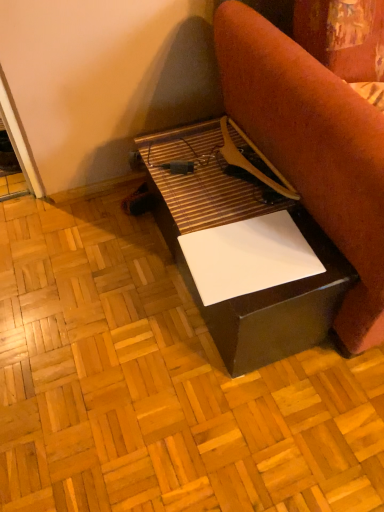
What do you see at coordinates (233, 221) in the screenshot? This screenshot has width=384, height=512. I see `matte black table at center` at bounding box center [233, 221].

At what (x,y) coordinates should I click in order to perform the action: click on matte black table at center. Please return your answer as a coordinate pair (x, y). Image resolution: width=384 pixels, height=512 pixels. Looking at the image, I should click on (233, 221).

Between white glossy paper at center and matte black table at center, which one has smaller width?

With smaller width is matte black table at center.

Could you tell me if white glossy paper at center is facing matte black table at center?

No, white glossy paper at center is not aimed at matte black table at center.

Which is closer to the camera, (246, 13) or (219, 132)?

Point (246, 13) appears to be closer to the viewer than point (219, 132).

Between white glossy paper at center and matte black table at center, which one has less height?

matte black table at center is shorter.

From the image's perspective, which is below, matte black table at center or white glossy paper at center?

matte black table at center is shown below in the image.

Is matte black table at center bigger or smaller than white glossy paper at center?

In the image, matte black table at center appears to be smaller than white glossy paper at center.

There is a matte black table at center. Identify the location of furniture above it (from a real-world perspective). This screenshot has height=512, width=384. (313, 150).

Is white glossy paper at center not near white glossy plywood at center?

white glossy paper at center is actually quite close to white glossy plywood at center.

Between white glossy paper at center and white glossy plywood at center, which one has smaller size?

Smaller between the two is white glossy plywood at center.

Is white glossy paper at center further to camera compared to white glossy plywood at center?

No, white glossy paper at center is closer to the viewer.

Is white glossy paper at center taller or shorter than white glossy plywood at center?

Considering their sizes, white glossy paper at center has more height than white glossy plywood at center.

Which is more to the left, white glossy plywood at center or white glossy paper at center?

white glossy plywood at center.

Is white glossy plywood at center facing towards white glossy paper at center?

No.

Is white glossy plywood at center positioned far away from white glossy paper at center?

That's not correct — white glossy plywood at center is a little close to white glossy paper at center.

How many degrees apart are the facing directions of white glossy plywood at center and white glossy paper at center?

The facing directions of white glossy plywood at center and white glossy paper at center are 180 degrees apart.

Does white glossy plywood at center have a lesser width compared to matte black table at center?

Incorrect, the width of white glossy plywood at center is not less than that of matte black table at center.

Is white glossy plywood at center not close to matte black table at center?

No, there isn't a large distance between white glossy plywood at center and matte black table at center.

Is matte black table at center surrounded by white glossy plywood at center?

No, matte black table at center is located outside of white glossy plywood at center.

From a real-world perspective, relative to matte black table at center, is white glossy plywood at center vertically above or below?

white glossy plywood at center is situated lower than matte black table at center in the real world.

Is matte black table at center next to white glossy plywood at center?

There is a gap between matte black table at center and white glossy plywood at center.

What's the angular difference between matte black table at center and white glossy plywood at center's facing directions?

The angle between the facing direction of matte black table at center and the facing direction of white glossy plywood at center is 179 degrees.

Could you tell me if matte black table at center is turned towards white glossy plywood at center?

No, matte black table at center does not turn towards white glossy plywood at center.

In terms of height, does matte black table at center look taller or shorter compared to white glossy plywood at center?

matte black table at center is taller than white glossy plywood at center.

Where is `furniture that appears in front of the matte black table at center`? furniture that appears in front of the matte black table at center is located at coordinates (x=313, y=150).

Where is `table to the left of white glossy paper at center`? This screenshot has width=384, height=512. table to the left of white glossy paper at center is located at coordinates (233, 221).

Estimate the real-world distances between objects in this image. Which object is closer to matte black table at center, white glossy plywood at center or white glossy paper at center?

white glossy paper at center lies closer to matte black table at center than the other object.

Looking at the image, which one is located further to white glossy plywood at center, matte black table at center or white glossy paper at center?

white glossy paper at center lies further to white glossy plywood at center than the other object.

When comparing their distances from white glossy paper at center, does matte black table at center or white glossy plywood at center seem closer?

matte black table at center is positioned closer to the anchor white glossy paper at center.

From the image, which object appears to be farther from white glossy paper at center, white glossy plywood at center or matte black table at center?

Among the two, white glossy plywood at center is located further to white glossy paper at center.

From the image, which object appears to be farther from matte black table at center, white glossy paper at center or white glossy plywood at center?

white glossy plywood at center lies further to matte black table at center than the other object.

Which object lies further to the anchor point white glossy plywood at center, white glossy paper at center or matte black table at center?

white glossy paper at center is further to white glossy plywood at center.

The image size is (384, 512). Identify the location of table between white glossy plywood at center and white glossy paper at center. (233, 221).